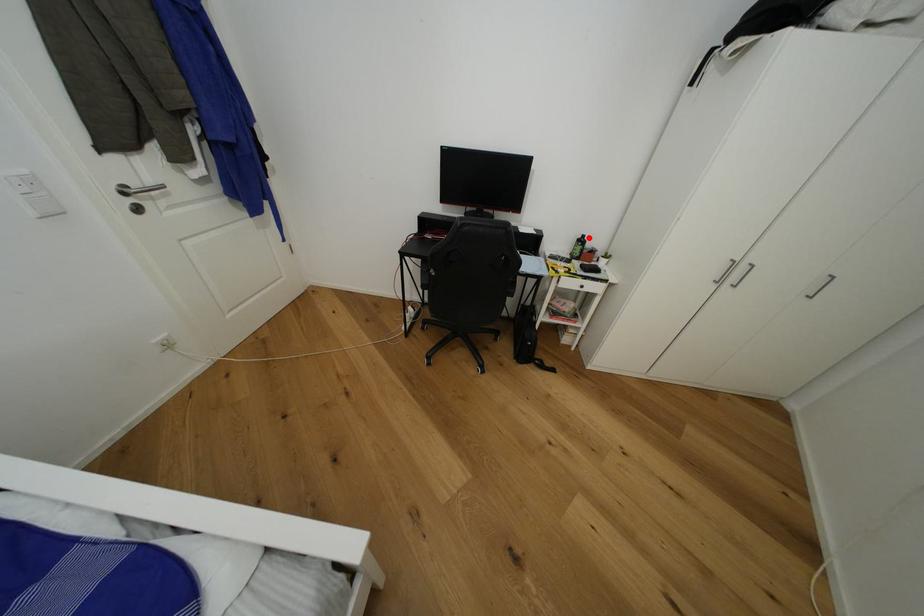
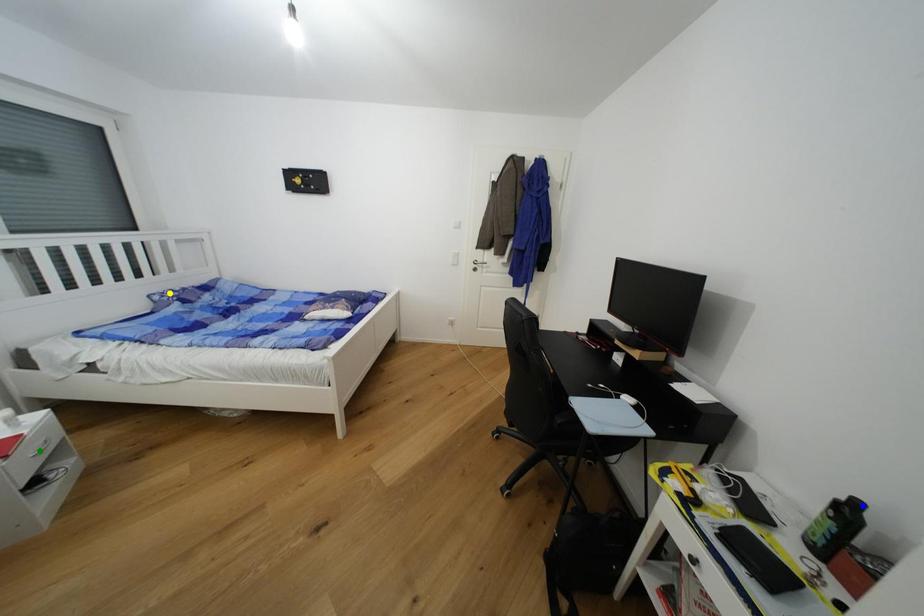
Question: I am providing you with two images of the same scene from different viewpoints. A red point is marked on the first image. You are given multiple points on the second image. Which mark in image 2 goes with the point in image 1?

Choices:
 (A) yellow point
 (B) blue point
 (C) green point

Answer: (B)